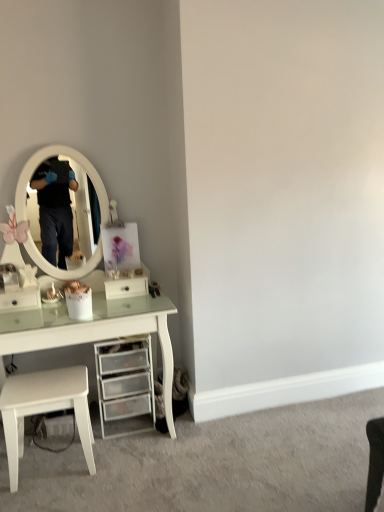
Locate an element on the screen. Image resolution: width=384 pixels, height=512 pixels. empty space that is ontop of white matte stool at lower left is located at coordinates (36, 389).